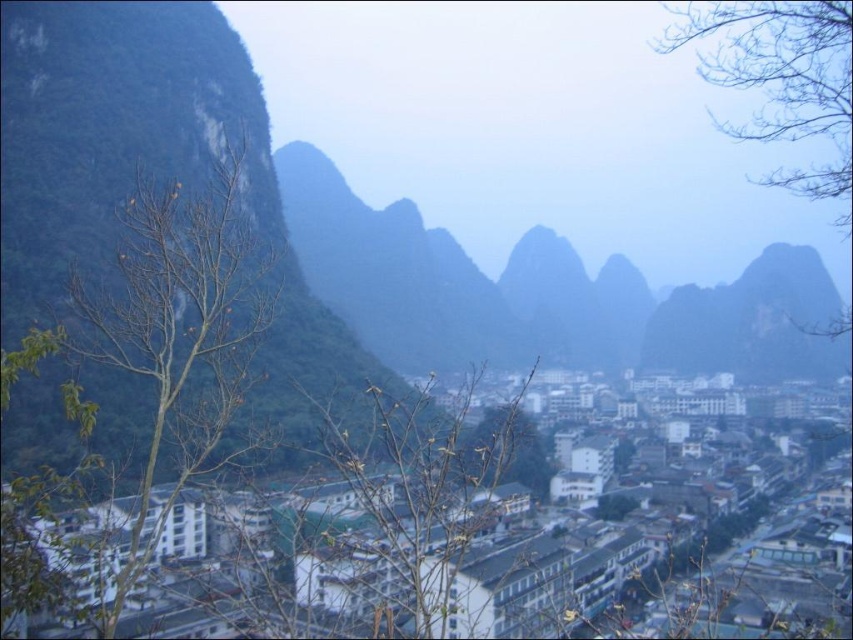
You are standing at the point closer to the front of the image. Which point, point (258, 572) or point (74, 301), is farther away from you?

Point (258, 572) is farther away from you because it is behind point (74, 301).

Looking at this image, you are a bird flying over the town and want to land on a spot that offers a clear view of both the white matte buildings at center and the brown leafless tree at left. Based on their sizes, which object should you choose to perch on?

The white matte buildings at center is bigger than the brown leafless tree at left, so you should perch on the white matte buildings at center to have a better vantage point for viewing both objects.

You are a drone operator who needs to deliver a package from the brown leafless tree at left to the white matte buildings at center. The drone has a maximum range of 40 meters. Can the drone complete the delivery without needing a recharge?

The distance between the brown leafless tree at left and the white matte buildings at center is 44.12 meters, which exceeds the drone operator stated maximum range of 40 meters. The drone cannot complete the delivery without needing a recharge.